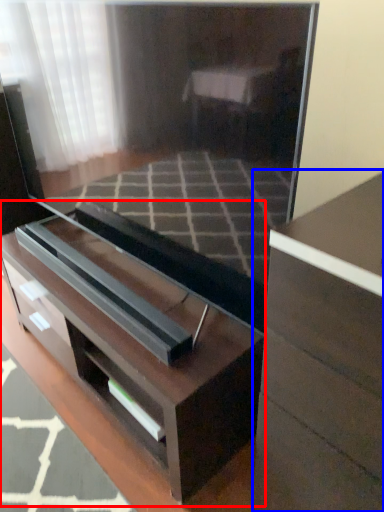
Question: Which object appears farthest to the camera in this image, chest of drawers (highlighted by a red box) or chest of drawers (highlighted by a blue box)?

Choices:
 (A) chest of drawers
 (B) chest of drawers

Answer: (A)